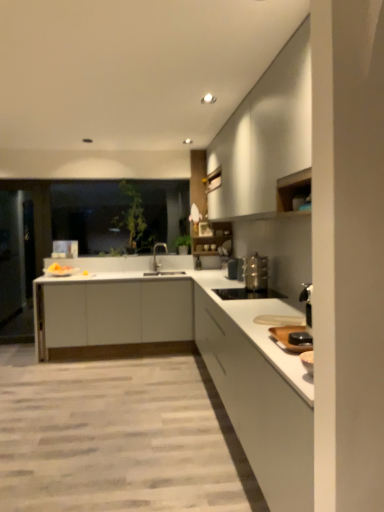
Measure the distance between point (290,497) and camera.

5.49 feet.

In order to face white matte cabinet at right, the third cabinetry viewed from the top, should I rotate leftwards or rightwards?

Turn right approximately 8.685 degrees to face it.

Identify the location of satin silver toaster at right, which ranks as the first appliance in top-to-bottom order. (256, 272).

You are a GUI agent. You are given a task and a screenshot of the screen. Output one action in this format:
    pyautogui.click(x=<x>, y=<y>)
    Task: Click on the satin nickel faucet at center
    The height and width of the screenshot is (512, 384).
    Given the screenshot: What is the action you would take?
    pyautogui.click(x=155, y=253)

Describe the element at coordinates (247, 294) in the screenshot. I see `satin silver toaster at lower right, the first appliance from the bottom` at that location.

This screenshot has width=384, height=512. Identify the location of white matte cabinet at right, the third cabinetry viewed from the top. (259, 408).

Does point (140, 234) appear closer or farther from the camera than point (276, 129)?

Clearly, point (140, 234) is more distant from the camera than point (276, 129).

From the image's perspective, is transparent glass window at center located above white matte cabinet at upper right, the third cabinetry in the bottom-to-top sequence?

No, from the image's perspective, transparent glass window at center is not on top of white matte cabinet at upper right, the third cabinetry in the bottom-to-top sequence.

Between transparent glass window at center and white matte cabinet at upper right, positioned as the first cabinetry in top-to-bottom order, which one has larger width?

white matte cabinet at upper right, positioned as the first cabinetry in top-to-bottom order.

Considering the relative sizes of transparent glass window at center and white matte cabinet at upper right, the third cabinetry in the bottom-to-top sequence, in the image provided, is transparent glass window at center bigger than white matte cabinet at upper right, the third cabinetry in the bottom-to-top sequence,?

No, transparent glass window at center is not bigger than white matte cabinet at upper right, the third cabinetry in the bottom-to-top sequence.

You are a GUI agent. You are given a task and a screenshot of the screen. Output one action in this format:
    pyautogui.click(x=<x>, y=<y>)
    Task: Click on the 1st appliance to the right of the transparent glass door at left, counting from the anchor's position
    This screenshot has height=512, width=384.
    Given the screenshot: What is the action you would take?
    pyautogui.click(x=247, y=294)

Is point (229, 295) closer to viewer compared to point (28, 230)?

Yes, it is.

Is satin silver toaster at lower right, the first appliance from the bottom, bigger or smaller than transparent glass door at left?

satin silver toaster at lower right, the first appliance from the bottom, is smaller than transparent glass door at left.

From a real-world perspective, is satin silver toaster at lower right, arranged as the 2th appliance when viewed from the top, physically above transparent glass door at left?

No, from a real-world perspective, satin silver toaster at lower right, arranged as the 2th appliance when viewed from the top, is not above transparent glass door at left.

Measure the distance from white matte countertop at center to white matte cabinet at right, which is counted as the first cabinetry, starting from the bottom.

A distance of 1.92 meters exists between white matte countertop at center and white matte cabinet at right, which is counted as the first cabinetry, starting from the bottom.

Does point (162, 303) come in front of point (254, 389)?

No.

Which object is thinner, white matte countertop at center or white matte cabinet at right, the third cabinetry viewed from the top?

white matte cabinet at right, the third cabinetry viewed from the top.

Looking at this image, how many degrees apart are the facing directions of white matte countertop at center and white matte cabinet at right, the third cabinetry viewed from the top?

The angle between the facing direction of white matte countertop at center and the facing direction of white matte cabinet at right, the third cabinetry viewed from the top, is 90.8 degrees.

Is satin nickel faucet at center aimed at white matte cabinet at right, which is counted as the first cabinetry, starting from the bottom?

No, satin nickel faucet at center is not turned towards white matte cabinet at right, which is counted as the first cabinetry, starting from the bottom.

From the image's perspective, which cabinetry is the 2nd one below the satin nickel faucet at center? Please provide its 2D coordinates.

[(259, 408)]

How different are the orientations of satin nickel faucet at center and white matte cabinet at right, the third cabinetry viewed from the top, in degrees?

The angular difference between satin nickel faucet at center and white matte cabinet at right, the third cabinetry viewed from the top, is 44.9 degrees.

Between satin nickel faucet at center and white matte cabinet at right, the third cabinetry viewed from the top, which one appears on the left side from the viewer's perspective?

satin nickel faucet at center.

In terms of height, does transparent glass door at left look taller or shorter compared to satin silver toaster at lower right, the first appliance from the bottom?

In the image, transparent glass door at left appears to be taller than satin silver toaster at lower right, the first appliance from the bottom.

Considering the relative sizes of transparent glass door at left and satin silver toaster at lower right, arranged as the 2th appliance when viewed from the top, in the image provided, is transparent glass door at left thinner than satin silver toaster at lower right, arranged as the 2th appliance when viewed from the top,?

Yes, transparent glass door at left is thinner than satin silver toaster at lower right, arranged as the 2th appliance when viewed from the top.

Consider the image. Which object is further away from the camera, transparent glass door at left or satin silver toaster at lower right, arranged as the 2th appliance when viewed from the top?

transparent glass door at left is further from the camera.

Considering the sizes of satin nickel faucet at center and transparent glass door at left in the image, is satin nickel faucet at center taller or shorter than transparent glass door at left?

In the image, satin nickel faucet at center appears to be shorter than transparent glass door at left.

Can you tell me how much satin nickel faucet at center and transparent glass door at left differ in facing direction?

They differ by 45 degrees in their facing directions.

Is satin nickel faucet at center placed right next to transparent glass door at left?

They are not placed beside each other.

From the picture: Is the position of satin nickel faucet at center more distant than that of transparent glass door at left?

No, the depth of satin nickel faucet at center is less than that of transparent glass door at left.

Could you tell me if white matte cabinet at center, placed as the second cabinetry when sorted from bottom to top, is turned towards satin silver toaster at lower right, the first appliance from the bottom?

Yes, white matte cabinet at center, placed as the second cabinetry when sorted from bottom to top, is aimed at satin silver toaster at lower right, the first appliance from the bottom.

Does white matte cabinet at center, the 2th cabinetry from the top, come in front of satin silver toaster at lower right, the first appliance from the bottom?

No.

From the image's perspective, which object appears higher, white matte cabinet at center, the 2th cabinetry from the top, or satin silver toaster at lower right, the first appliance from the bottom?

satin silver toaster at lower right, the first appliance from the bottom, appears higher in the image.

Where is `window screen lying on the left of white matte cabinet at upper right, positioned as the first cabinetry in top-to-bottom order`? The image size is (384, 512). window screen lying on the left of white matte cabinet at upper right, positioned as the first cabinetry in top-to-bottom order is located at coordinates (91, 215).

The image size is (384, 512). I want to click on the 2nd appliance in front of the transparent glass door at left, so click(247, 294).

When comparing their distances from white matte cabinet at center, the 2th cabinetry from the top, does transparent glass window at center or satin nickel faucet at center seem further?

transparent glass window at center lies further to white matte cabinet at center, the 2th cabinetry from the top, than the other object.

Which object lies further to the anchor point white matte countertop at center, white matte cabinet at upper right, positioned as the first cabinetry in top-to-bottom order, or transparent glass window at center?

Based on the image, transparent glass window at center appears to be further to white matte countertop at center.

Looking at this image, based on their spatial positions, is transparent glass window at center or white matte cabinet at center, the 2th cabinetry from the top, further from white matte countertop at center?

Among the two, transparent glass window at center is located further to white matte countertop at center.

Which object lies nearer to the anchor point satin silver toaster at right, arranged as the second appliance when ordered from the bottom, satin silver toaster at lower right, the first appliance from the bottom, or transparent glass door at left?

satin silver toaster at lower right, the first appliance from the bottom, lies closer to satin silver toaster at right, arranged as the second appliance when ordered from the bottom, than the other object.

Looking at this image, considering their positions, is transparent glass door at left positioned closer to satin nickel faucet at center than white matte cabinet at right, the third cabinetry viewed from the top?

Among the two, transparent glass door at left is located nearer to satin nickel faucet at center.

From the image, which object appears to be nearer to white matte cabinet at center, placed as the second cabinetry when sorted from bottom to top, white matte cabinet at upper right, the third cabinetry in the bottom-to-top sequence, or white matte countertop at center?

Among the two, white matte countertop at center is located nearer to white matte cabinet at center, placed as the second cabinetry when sorted from bottom to top.

Looking at the image, which one is located further to transparent glass window at center, white matte cabinet at center, the 2th cabinetry from the top, or satin silver toaster at right, which ranks as the first appliance in top-to-bottom order?

satin silver toaster at right, which ranks as the first appliance in top-to-bottom order, is further to transparent glass window at center.

From the image, which object appears to be nearer to transparent glass door at left, white matte cabinet at upper right, the third cabinetry in the bottom-to-top sequence, or satin nickel faucet at center?

satin nickel faucet at center is positioned closer to the anchor transparent glass door at left.

The image size is (384, 512). I want to click on appliance between satin silver toaster at lower right, the first appliance from the bottom, and satin nickel faucet at center, along the z-axis, so click(256, 272).

Locate an element on the screen. cabinetry positioned between white matte cabinet at upper right, positioned as the first cabinetry in top-to-bottom order, and satin nickel faucet at center from near to far is located at coordinates (114, 318).

Where is `cabinetry between satin silver toaster at right, which ranks as the first appliance in top-to-bottom order, and transparent glass window at center in the front-back direction`? cabinetry between satin silver toaster at right, which ranks as the first appliance in top-to-bottom order, and transparent glass window at center in the front-back direction is located at coordinates (114, 318).

Locate an element on the screen. The width and height of the screenshot is (384, 512). cabinetry between satin silver toaster at lower right, the first appliance from the bottom, and transparent glass window at center from front to back is located at coordinates (114, 318).